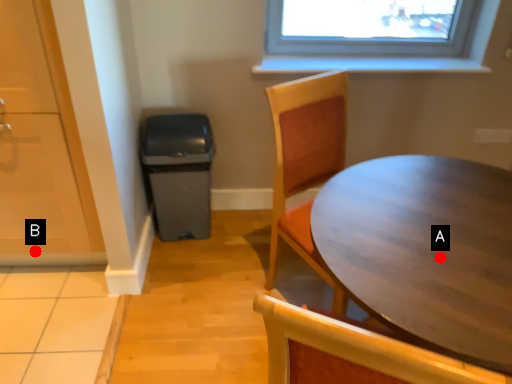
Question: Two points are circled on the image, labeled by A and B beside each circle. Which point is closer to the camera?

Choices:
 (A) A is closer
 (B) B is closer

Answer: (A)